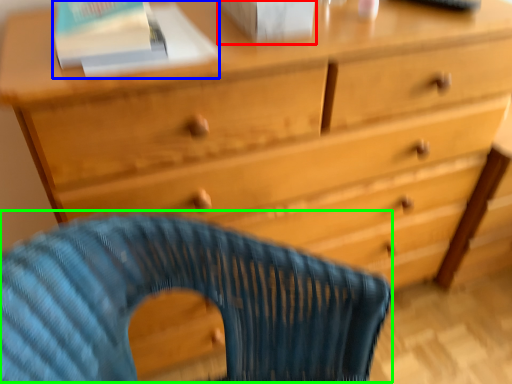
Question: Which object is the farthest from paperback book (highlighted by a red box)? Choose among these: paperback book (highlighted by a blue box) or rocking chair (highlighted by a green box).

Choices:
 (A) paperback book
 (B) rocking chair

Answer: (B)